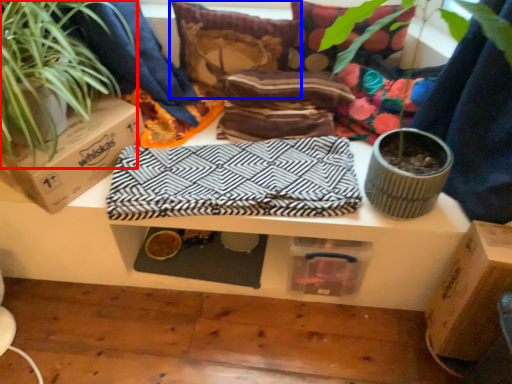
Question: Among these objects, which one is farthest to the camera, houseplant (highlighted by a red box) or pillow (highlighted by a blue box)?

Choices:
 (A) houseplant
 (B) pillow

Answer: (B)